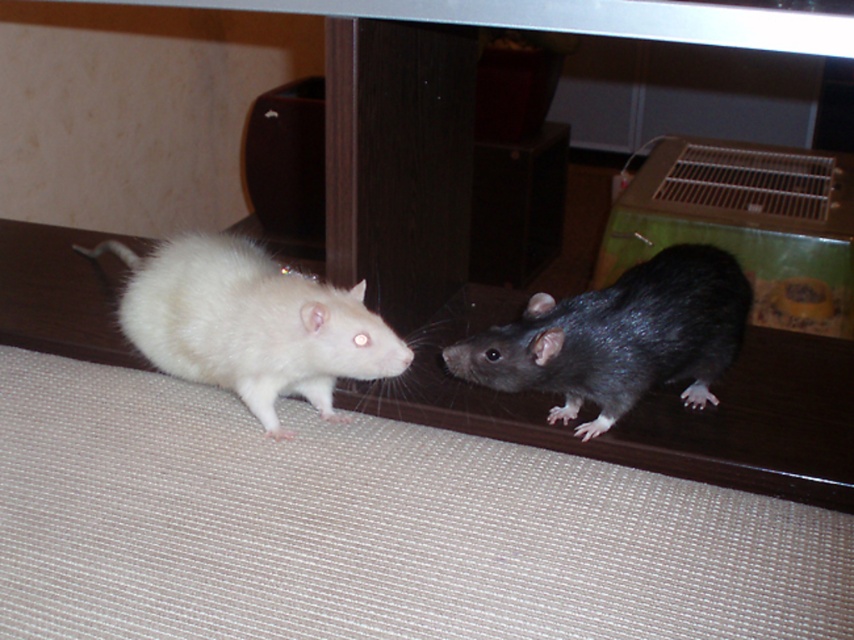
Who is higher up, white furry hamster at left or shiny black rat at right?

white furry hamster at left is above.

Can you confirm if white furry hamster at left is thinner than shiny black rat at right?

In fact, white furry hamster at left might be wider than shiny black rat at right.

Who is more distant from viewer, (x=316, y=294) or (x=556, y=355)?

Positioned behind is point (x=316, y=294).

You are a GUI agent. You are given a task and a screenshot of the screen. Output one action in this format:
    pyautogui.click(x=<x>, y=<y>)
    Task: Click on the white furry hamster at left
    This screenshot has height=640, width=854.
    Given the screenshot: What is the action you would take?
    pyautogui.click(x=249, y=323)